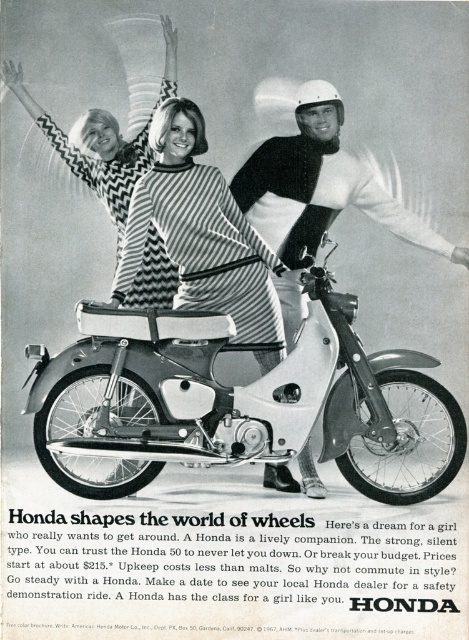
Question: Is striped fabric dress at center above white helmet at center?

Choices:
 (A) no
 (B) yes

Answer: (A)

Question: Among these objects, which one is farthest from the camera?

Choices:
 (A) striped fabric dress at center
 (B) white helmet at center
 (C) white matte motorcycle at center

Answer: (A)

Question: Estimate the real-world distances between objects in this image. Which object is closer to the white matte motorcycle at center?

Choices:
 (A) white helmet at center
 (B) striped fabric dress at center

Answer: (B)

Question: Among these points, which one is nearest to the camera?

Choices:
 (A) (257, 314)
 (B) (332, 157)
 (C) (189, 323)

Answer: (C)

Question: Is striped fabric dress at center to the right of white helmet at center from the viewer's perspective?

Choices:
 (A) yes
 (B) no

Answer: (B)

Question: Is white matte motorcycle at center to the right of white helmet at center from the viewer's perspective?

Choices:
 (A) no
 (B) yes

Answer: (A)